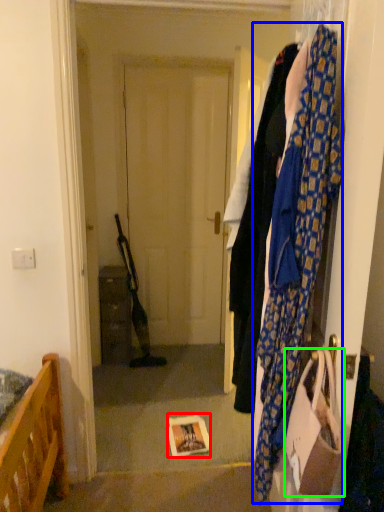
Question: Which object is positioned farthest from book (highlighted by a red box)? Select from scarf (highlighted by a blue box) and handbag (highlighted by a green box).

Choices:
 (A) scarf
 (B) handbag

Answer: (A)